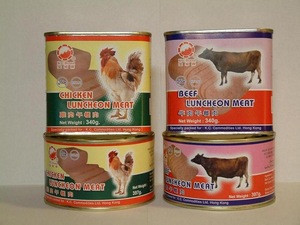
The width and height of the screenshot is (300, 225). In order to click on wall in this screenshot , I will do `click(197, 15)`.